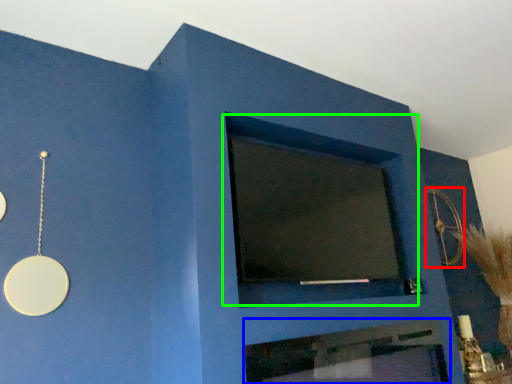
Question: Considering the real-world distances, which object is farthest from circle (highlighted by a red box)? fireplace (highlighted by a blue box) or window (highlighted by a green box)?

Choices:
 (A) fireplace
 (B) window

Answer: (A)